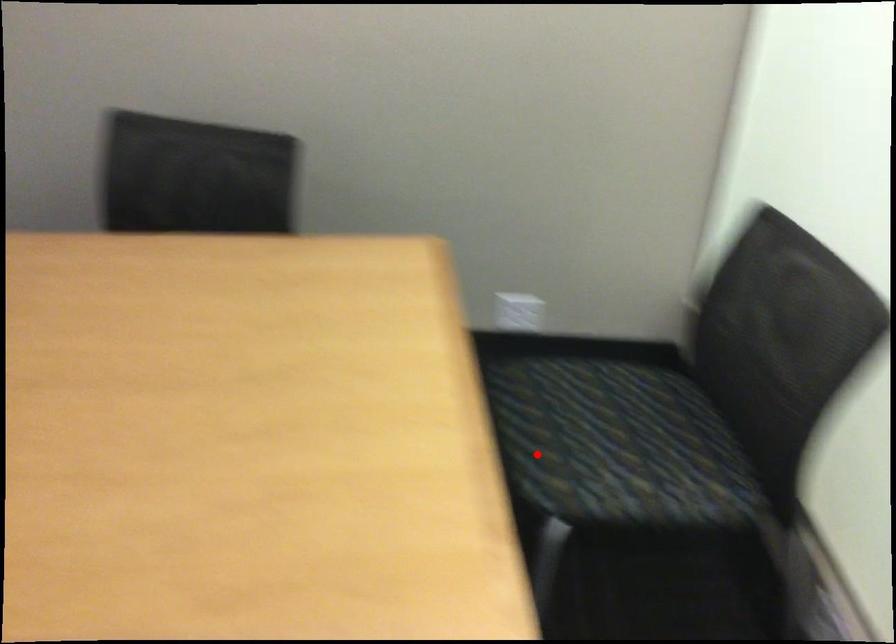
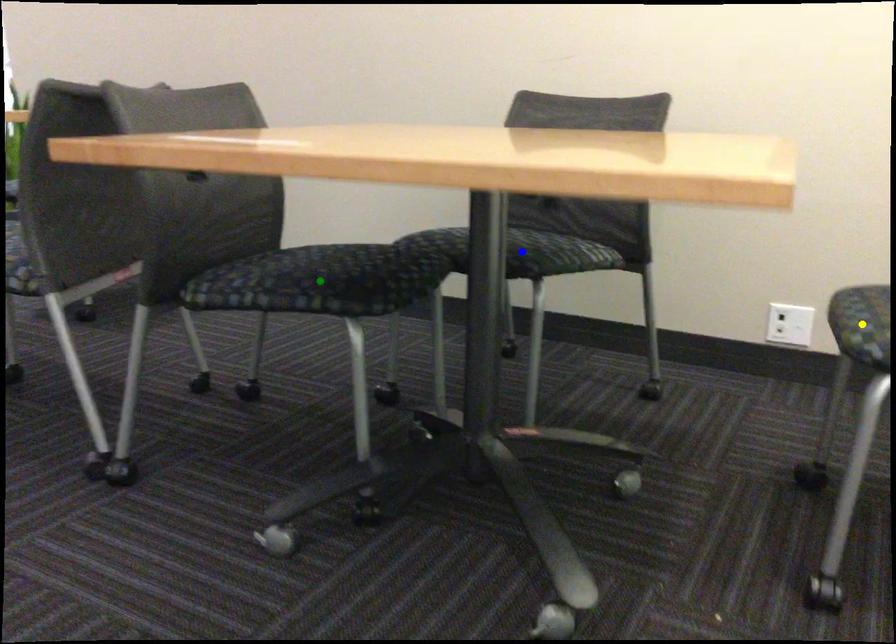
Question: I am providing you with two images of the same scene from different viewpoints. A red point is marked on the first image. You are given multiple points on the second image. Which point in image 2 is actually the same real-world point as the red point in image 1?

Choices:
 (A) green point
 (B) blue point
 (C) yellow point

Answer: (C)